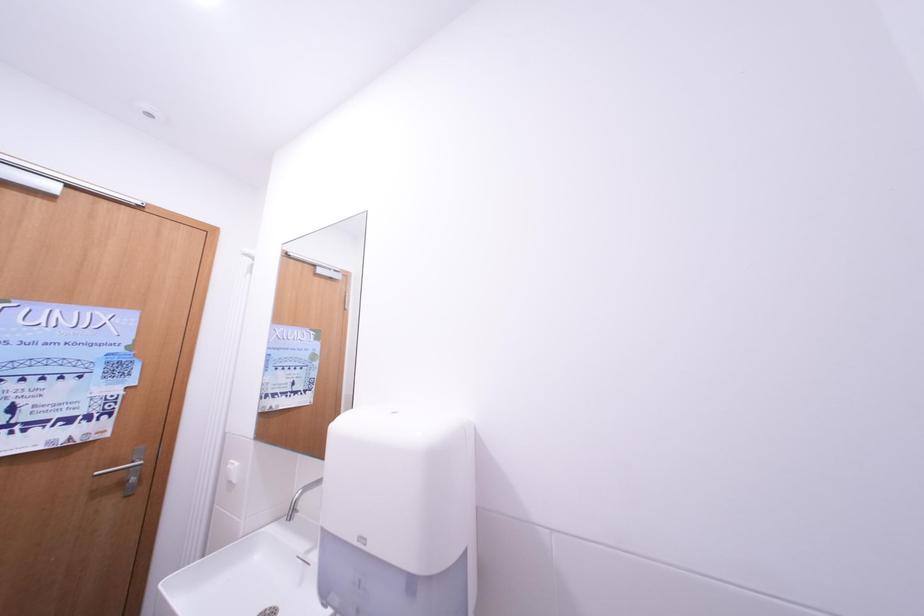
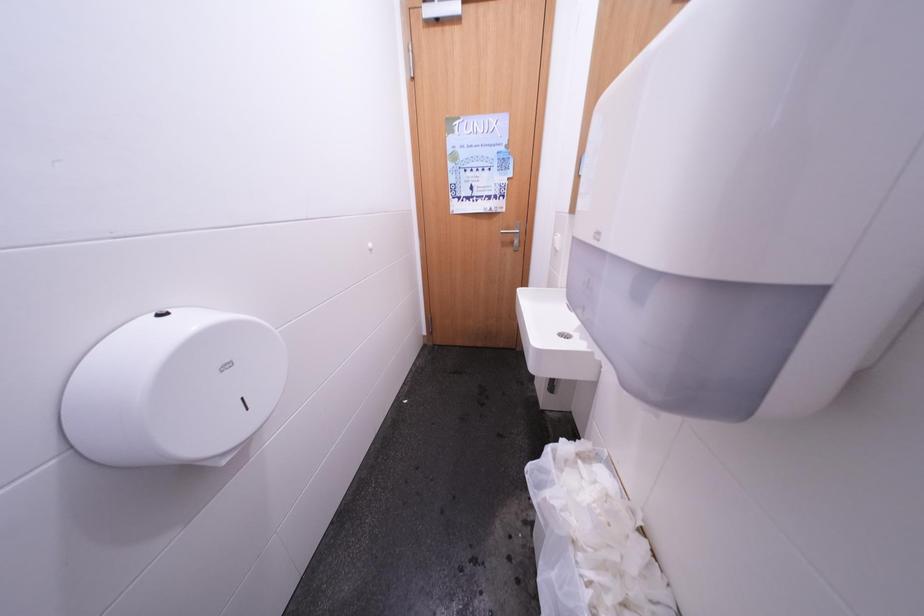
Based on the continuous images, in which direction is the camera rotating?

The rotation direction of the camera is left-down.